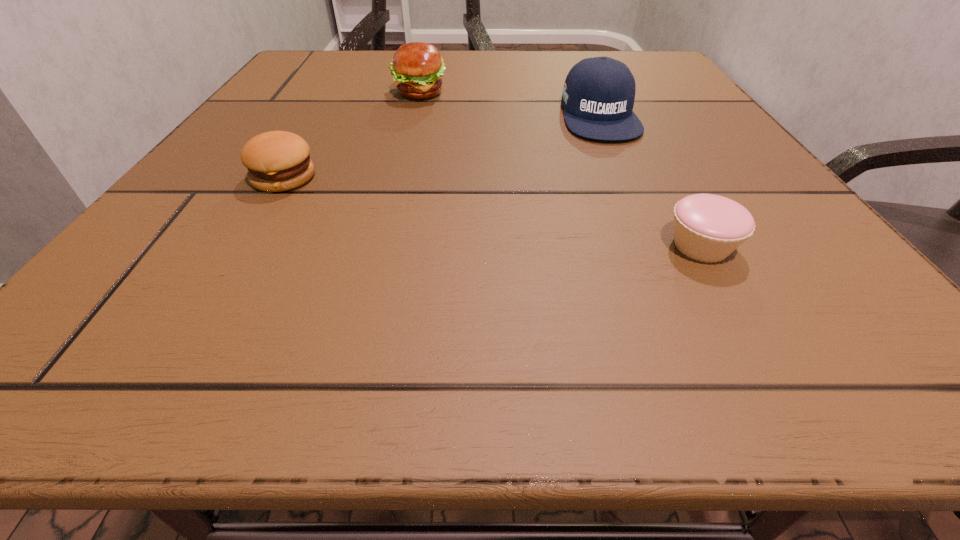
Where is `the taller hamburger`? The image size is (960, 540). the taller hamburger is located at coordinates (417, 67).

Find the location of a particular element. The width and height of the screenshot is (960, 540). the right hamburger is located at coordinates (417, 67).

Locate an element on the screen. The image size is (960, 540). baseball cap is located at coordinates (x=598, y=96).

Where is `the second nearest object`? The height and width of the screenshot is (540, 960). the second nearest object is located at coordinates (277, 161).

The image size is (960, 540). What are the coordinates of `the left hamburger` in the screenshot? It's located at (277, 161).

I want to click on cupcake, so click(x=708, y=228).

Identify the location of free location located on the front of the right hamburger. The image size is (960, 540). (411, 125).

Where is `vacant space positioned 0.400m on the front-facing side of the baseball cap`? vacant space positioned 0.400m on the front-facing side of the baseball cap is located at coordinates (699, 337).

The width and height of the screenshot is (960, 540). I want to click on blank space located 0.100m on the right of the left hamburger, so click(383, 178).

The image size is (960, 540). What are the coordinates of `blank space located 0.370m on the left of the nearest object` in the screenshot? It's located at (363, 245).